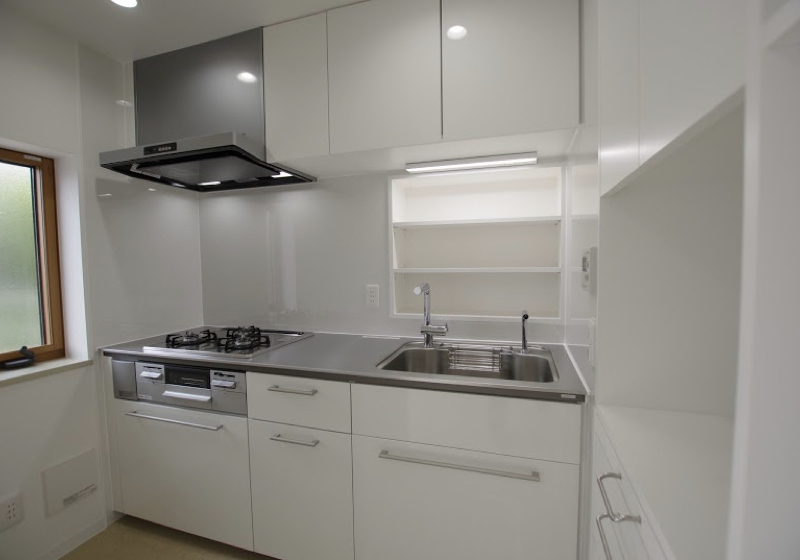
At what (x,y) coordinates should I click in order to perform the action: click on sink. Please return your answer as a coordinate pair (x, y). Looking at the image, I should click on pos(470,374).